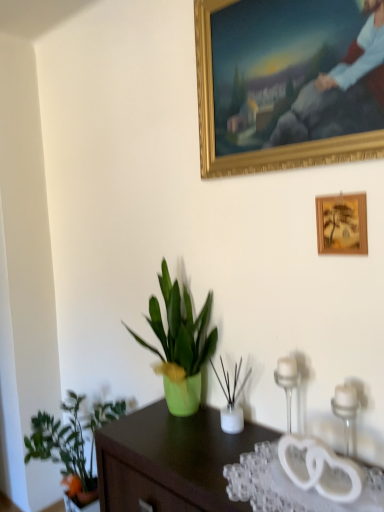
Question: Is green matte plant at lower left, placed as the 1th houseplant when sorted from left to right, to the left or to the right of green matte plant at center, which appears as the 2th houseplant when viewed from the left, in the image?

Choices:
 (A) left
 (B) right

Answer: (A)

Question: Is green matte plant at lower left, placed as the 1th houseplant when sorted from left to right, in front of or behind green matte plant at center, marked as the 2th houseplant in a right-to-left arrangement, in the image?

Choices:
 (A) front
 (B) behind

Answer: (B)

Question: Which object is positioned closest to the white glass candle holder at right, placed as the second candle holder when sorted from left to right?

Choices:
 (A) gold-framed painting at upper center, the 1th picture frame when ordered from top to bottom
 (B) green matte plant at lower left, acting as the first houseplant starting from the bottom
 (C) green matte plant at center, which is the 3th houseplant in bottom-to-top order
 (D) wooden picture frame at lower right, placed as the first picture frame when sorted from bottom to top
 (E) clear glass candle holder at right, marked as the 2th candle holder in a right-to-left arrangement

Answer: (E)

Question: Considering the real-world distances, which object is closest to the green matte plant at center, marked as the 2th houseplant in a right-to-left arrangement?

Choices:
 (A) gold-framed painting at upper center, the 1th picture frame when ordered from top to bottom
 (B) white glass candle holder at right, the second candle holder from the back
 (C) wooden picture frame at lower right, placed as the first picture frame when sorted from bottom to top
 (D) green matte plant at lower left, acting as the first houseplant starting from the bottom
 (E) transparent plastic glass table at lower right

Answer: (E)